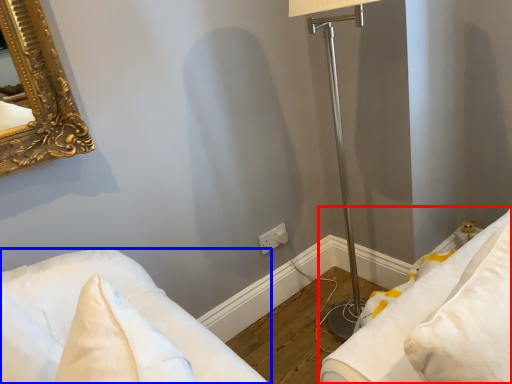
Question: Which point is closer to the camera, furniture (highlighted by a red box) or furniture (highlighted by a blue box)?

Choices:
 (A) furniture
 (B) furniture

Answer: (B)